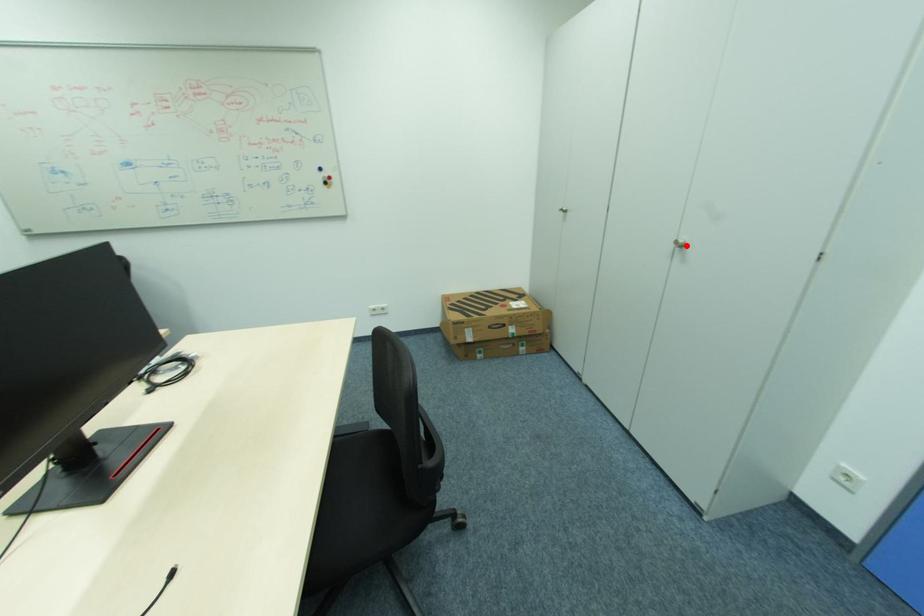
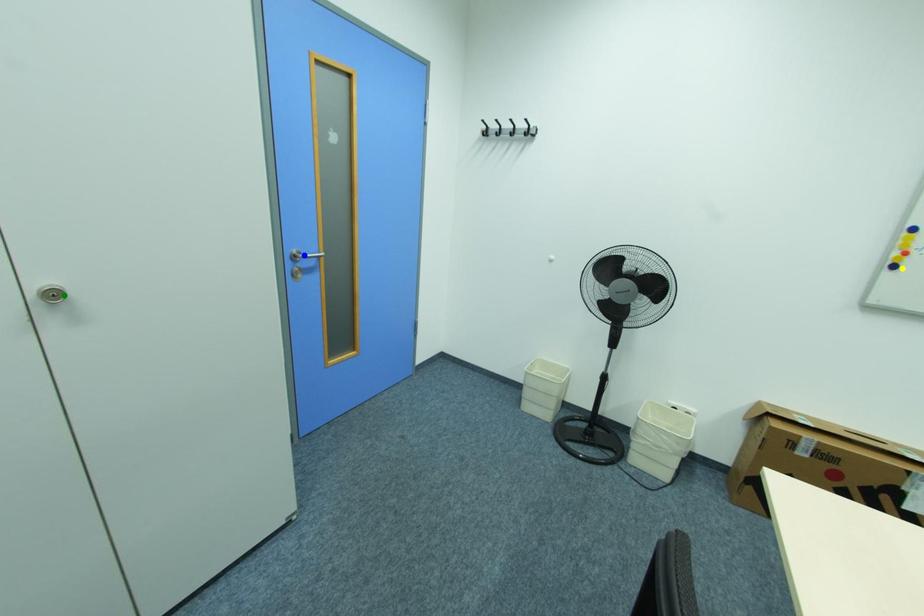
Question: I am providing you with two images of the same scene from different viewpoints. A red point is marked on the first image. You are given multiple points on the second image. In image 2, which mark is for the same physical point as the one in image 1?

Choices:
 (A) green point
 (B) blue point
 (C) yellow point

Answer: (A)